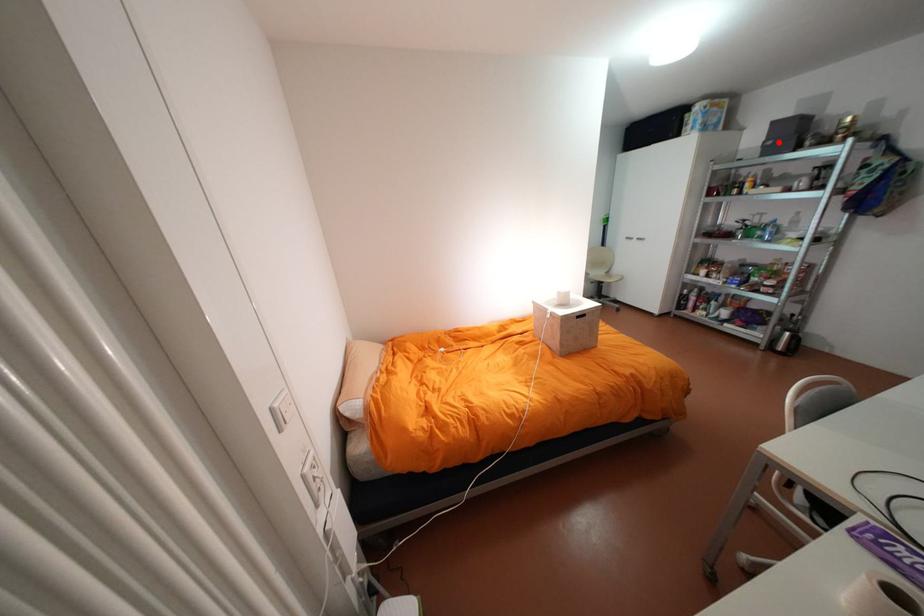
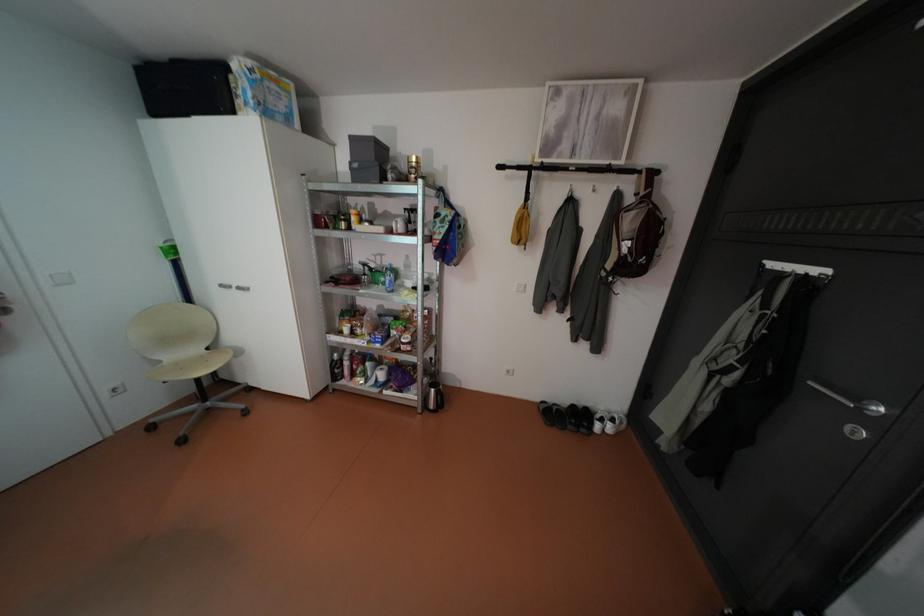
Locate, in the second image, the point that corresponds to the highlighted location in the first image.

(365, 164)